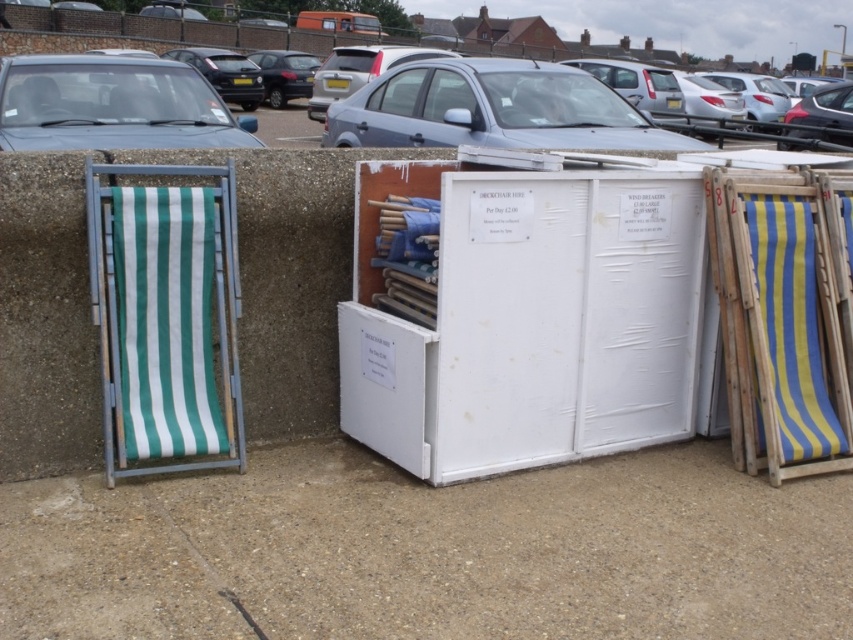
Question: Can you confirm if silver metallic car at upper center is positioned to the left of matte black car at center?

Choices:
 (A) yes
 (B) no

Answer: (B)

Question: Can you confirm if blue striped wood at right is positioned above silver metallic car at upper center?

Choices:
 (A) no
 (B) yes

Answer: (A)

Question: Which of these objects is positioned farthest from the blue striped wood at right?

Choices:
 (A) silver metallic car at upper center
 (B) satin silver sedan at upper center
 (C) matte black car at center
 (D) green striped fabric beach chair at left

Answer: (C)

Question: Estimate the real-world distances between objects in this image. Which object is closer to the blue striped wood at right?

Choices:
 (A) green striped fabric beach chair at left
 (B) matte black car at center

Answer: (A)

Question: Which object appears closest to the camera in this image?

Choices:
 (A) green striped fabric beach chair at left
 (B) matte black car at center

Answer: (A)

Question: Does blue striped wood at right appear on the left side of matte gray car at upper left?

Choices:
 (A) no
 (B) yes

Answer: (A)